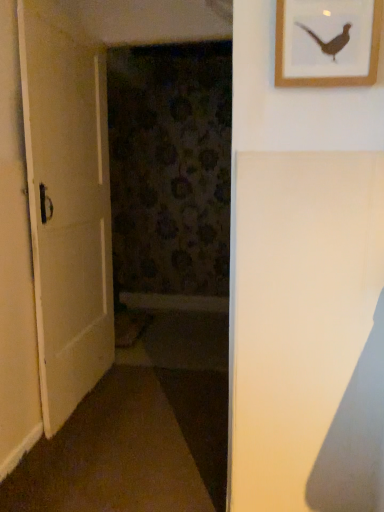
Locate an element on the screen. wooden picture frame at upper right is located at coordinates (330, 76).

This screenshot has height=512, width=384. What do you see at coordinates (330, 76) in the screenshot? I see `wooden picture frame at upper right` at bounding box center [330, 76].

In order to click on white matte door at left in this screenshot , I will do `click(67, 204)`.

This screenshot has width=384, height=512. What do you see at coordinates (67, 204) in the screenshot? I see `white matte door at left` at bounding box center [67, 204].

Measure the distance between point (104,117) and camera.

2.44 meters.

The image size is (384, 512). Find the location of `wooden picture frame at upper right`. wooden picture frame at upper right is located at coordinates (330, 76).

Between white matte door at left and wooden picture frame at upper right, which one appears on the right side from the viewer's perspective?

From the viewer's perspective, wooden picture frame at upper right appears more on the right side.

Is the position of white matte door at left less distant than that of wooden picture frame at upper right?

No, the depth of white matte door at left is greater than that of wooden picture frame at upper right.

Which is closer to the camera, (51, 72) or (282, 76)?

Point (51, 72) is positioned farther from the camera compared to point (282, 76).

From the image's perspective, would you say white matte door at left is shown under wooden picture frame at upper right?

Yes, from the image's perspective, white matte door at left is beneath wooden picture frame at upper right.

From a real-world perspective, is white matte door at left over wooden picture frame at upper right?

No.

Which of these two, white matte door at left or wooden picture frame at upper right, is thinner?

wooden picture frame at upper right is thinner.

Is white matte door at left taller or shorter than wooden picture frame at upper right?

Clearly, white matte door at left is taller compared to wooden picture frame at upper right.

Considering the relative sizes of white matte door at left and wooden picture frame at upper right in the image provided, is white matte door at left bigger than wooden picture frame at upper right?

Yes, white matte door at left is bigger than wooden picture frame at upper right.

Can wooden picture frame at upper right be found inside white matte door at left?

No, wooden picture frame at upper right is not a part of white matte door at left.

Is white matte door at left positioned far away from wooden picture frame at upper right?

Yes, white matte door at left and wooden picture frame at upper right are located far from each other.

Is white matte door at left facing away from wooden picture frame at upper right?

No, white matte door at left is not facing the opposite direction of wooden picture frame at upper right.

How much distance is there between white matte door at left and wooden picture frame at upper right?

1.40 meters.

At what (x,y) coordinates should I click in order to perform the action: click on picture frame in front of the white matte door at left. Please return your answer as a coordinate pair (x, y). This screenshot has height=512, width=384. Looking at the image, I should click on (330, 76).

Can you confirm if wooden picture frame at upper right is positioned to the left of white matte door at left?

Incorrect, wooden picture frame at upper right is not on the left side of white matte door at left.

Which object is further away from the camera, wooden picture frame at upper right or white matte door at left?

white matte door at left is behind.

Between point (336, 79) and point (47, 152), which one is positioned in front?

The point (336, 79) is closer to the camera.

From the image's perspective, is wooden picture frame at upper right above or below white matte door at left?

Clearly, from the image's perspective, wooden picture frame at upper right is above white matte door at left.

From a real-world perspective, which object rests below the other?

white matte door at left.

Considering the relative sizes of wooden picture frame at upper right and white matte door at left in the image provided, is wooden picture frame at upper right wider than white matte door at left?

No, wooden picture frame at upper right is not wider than white matte door at left.

In terms of height, does wooden picture frame at upper right look taller or shorter compared to white matte door at left?

Clearly, wooden picture frame at upper right is shorter compared to white matte door at left.

Considering the sizes of objects wooden picture frame at upper right and white matte door at left in the image provided, who is bigger, wooden picture frame at upper right or white matte door at left?

white matte door at left is bigger.

Is wooden picture frame at upper right completely or partially outside of white matte door at left?

Absolutely, wooden picture frame at upper right is external to white matte door at left.

Are wooden picture frame at upper right and white matte door at left making contact?

No, wooden picture frame at upper right is not touching white matte door at left.

Is wooden picture frame at upper right facing towards white matte door at left?

No, wooden picture frame at upper right is not facing towards white matte door at left.

How different are the orientations of wooden picture frame at upper right and white matte door at left in degrees?

88.5 degrees separate the facing orientations of wooden picture frame at upper right and white matte door at left.

This screenshot has width=384, height=512. In order to click on picture frame above the white matte door at left (from the image's perspective) in this screenshot , I will do `click(330, 76)`.

I want to click on picture frame above the white matte door at left (from a real-world perspective), so click(330, 76).

Identify the location of door to the left of wooden picture frame at upper right. Image resolution: width=384 pixels, height=512 pixels. (67, 204).